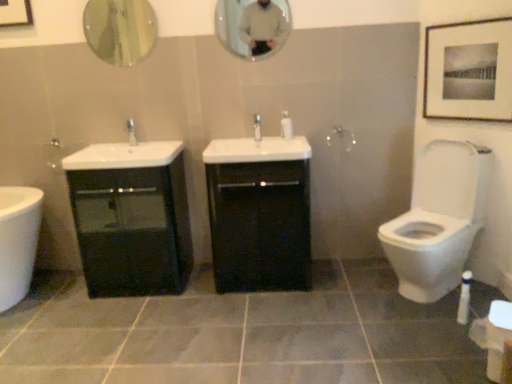
This screenshot has width=512, height=384. Identify the location of free space to the left of black glossy cabinet at left, which appears as the second bathroom cabinet when viewed from the right. (50, 298).